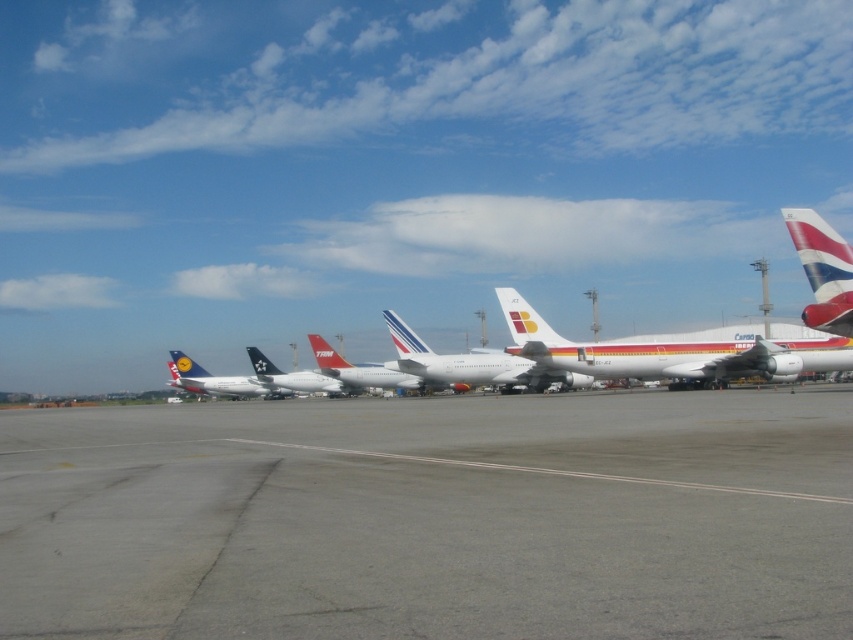
Question: Is gray asphalt runway at center above metallic silver airplane at left?

Choices:
 (A) yes
 (B) no

Answer: (A)

Question: Is red and white striped tail at right positioned at the back of metallic silver airplane at left?

Choices:
 (A) yes
 (B) no

Answer: (B)

Question: Which of these objects is positioned farthest from the white matte airplane at center?

Choices:
 (A) white glossy airplane at center
 (B) metallic silver airplane at center
 (C) gray asphalt runway at center

Answer: (B)

Question: Which is farther from the gray asphalt runway at center?

Choices:
 (A) white matte airplane at center
 (B) white glossy airplane at center

Answer: (B)

Question: Which is farther from the white glossy airplane at center?

Choices:
 (A) metallic silver airplane at center
 (B) metallic silver airplane at left
 (C) gray asphalt runway at center
 (D) white matte airplane at center

Answer: (C)

Question: Does gray asphalt runway at center appear under white matte airplane at center?

Choices:
 (A) yes
 (B) no

Answer: (A)